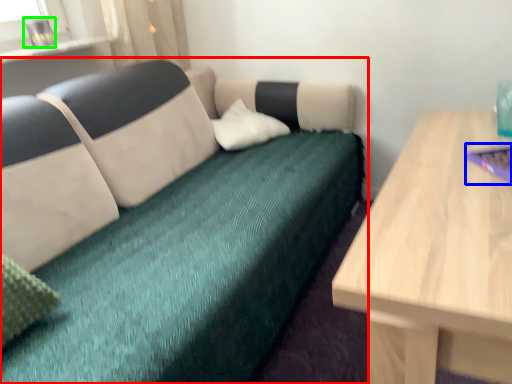
Question: Considering the real-world distances, which object is closest to studio couch (highlighted by a red box)? laptop (highlighted by a blue box) or glass vase (highlighted by a green box).

Choices:
 (A) laptop
 (B) glass vase

Answer: (B)